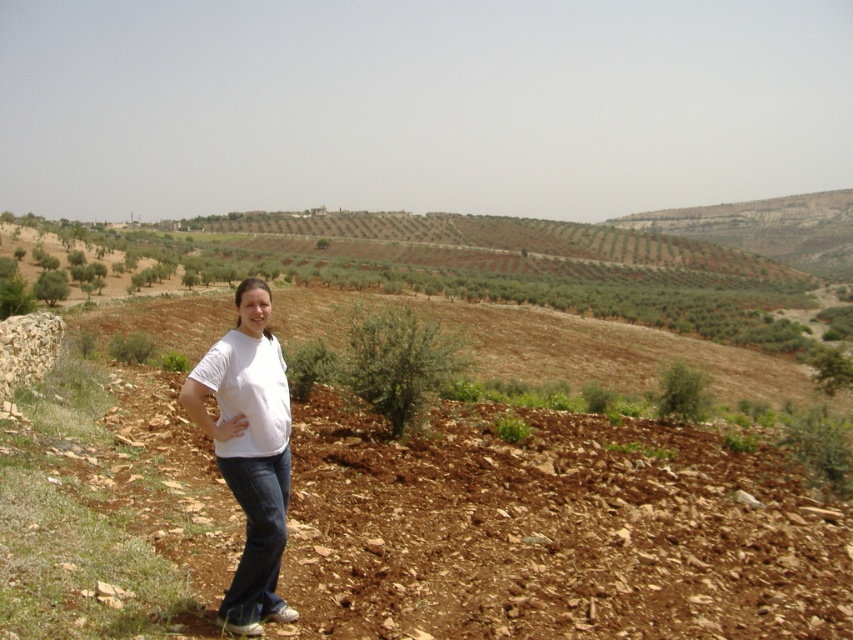
Does brown rocky dirt track at center have a greater height compared to white cotton shirt at center?

No.

Between brown rocky dirt track at center and white cotton shirt at center, which one has less height?

brown rocky dirt track at center is shorter.

Who is more distant from viewer, [514,618] or [241,570]?

Point [514,618]

The image size is (853, 640). I want to click on brown rocky dirt track at center, so click(552, 531).